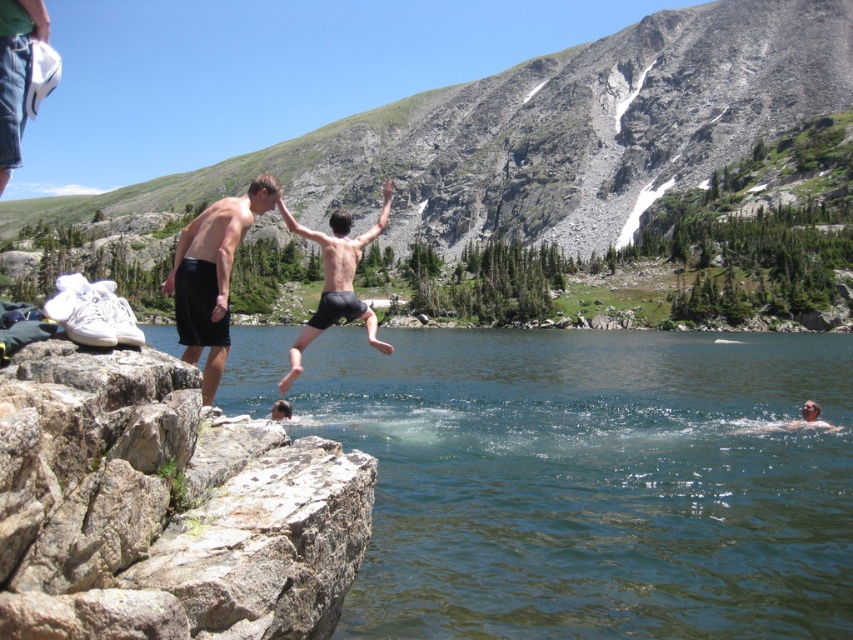
You are a photographer planning to capture the scene of the rough textured rock at left and the black matte shorts at center. If you want to ensure both objects are in focus, which object should you adjust your camera focus on first considering their sizes?

The rough textured rock at left is narrower than the black matte shorts at center, so you should focus on the rough textured rock at left first since smaller objects require precise focus adjustments.